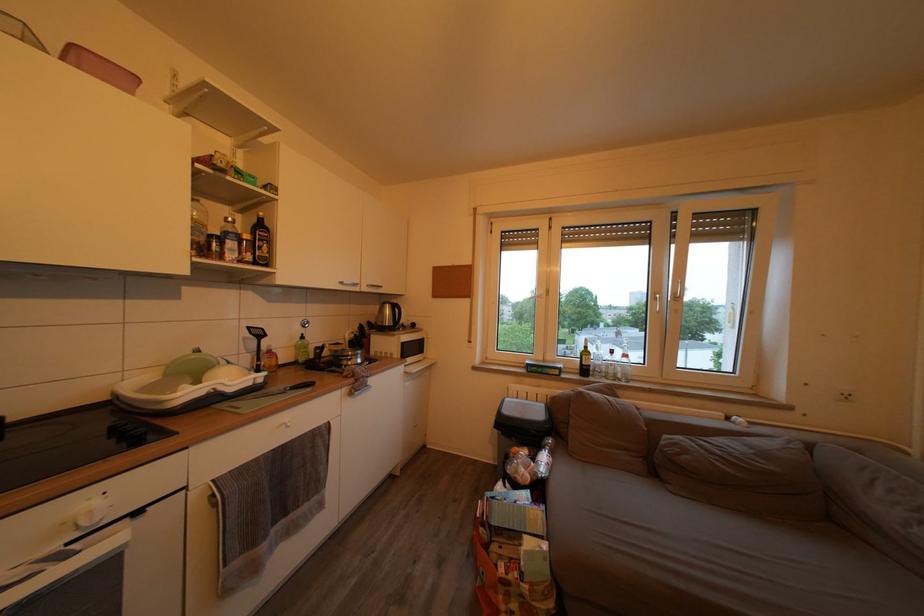
What do you see at coordinates (225, 466) in the screenshot? I see `the recessed cabinet handle` at bounding box center [225, 466].